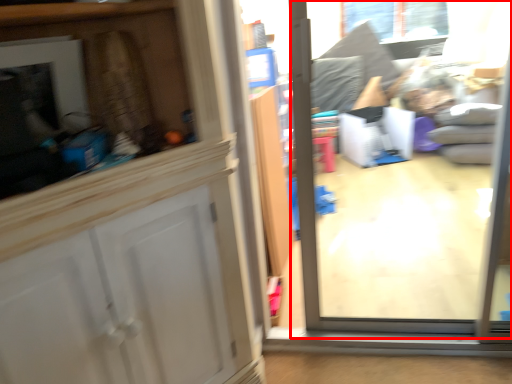
Question: From the image's perspective, what is the correct spatial relationship of glass door (annotated by the red box) in relation to window?

Choices:
 (A) above
 (B) below

Answer: (B)